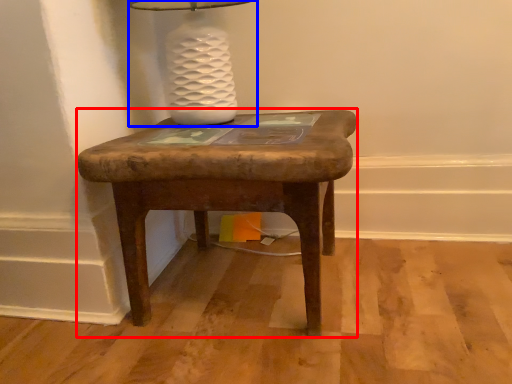
Question: Among these objects, which one is farthest to the camera, stool (highlighted by a red box) or table lamp (highlighted by a blue box)?

Choices:
 (A) stool
 (B) table lamp

Answer: (B)